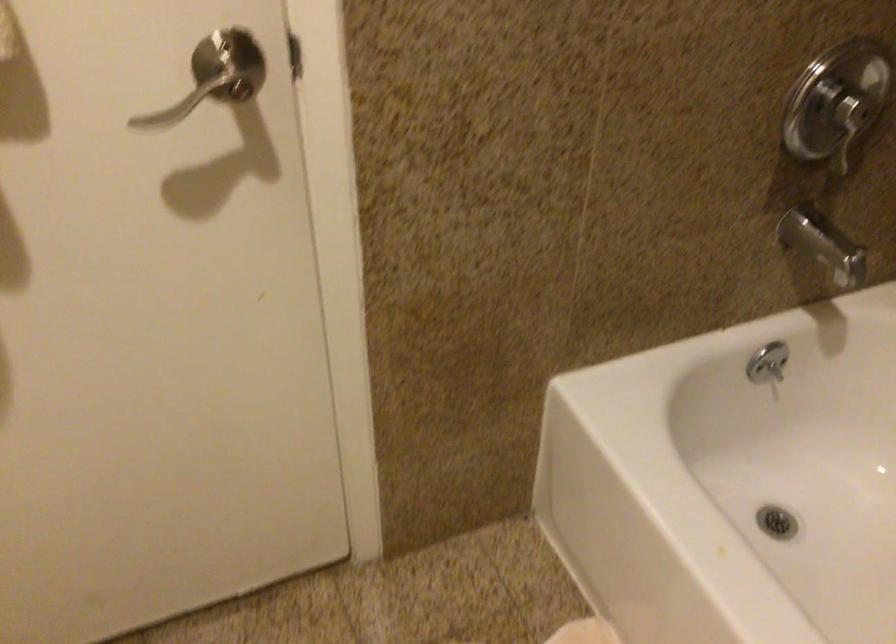
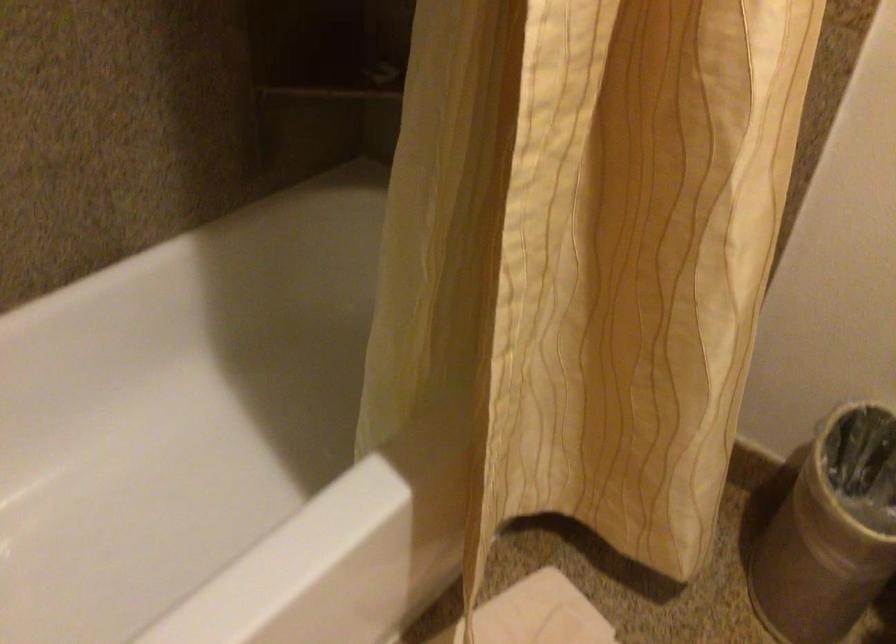
How did the camera likely rotate?

The camera's rotation is toward right-down.